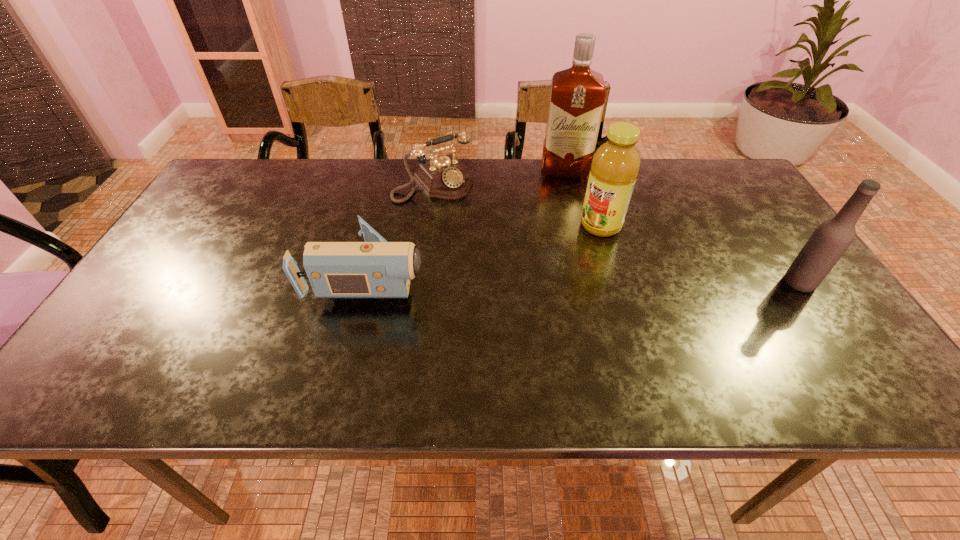
Where is `camcorder`? camcorder is located at coordinates (376, 268).

Image resolution: width=960 pixels, height=540 pixels. Identify the location of beer bottle. (830, 240).

The width and height of the screenshot is (960, 540). In order to click on the third farthest object in this screenshot , I will do `click(615, 166)`.

At what (x,y) coordinates should I click in order to perform the action: click on telephone. Please return your answer as a coordinate pair (x, y). Looking at the image, I should click on coord(446,177).

The image size is (960, 540). I want to click on liquor, so click(577, 96).

The height and width of the screenshot is (540, 960). Find the location of `vacant region located 0.400m on the side of the camcorder with the flip-out screen`. vacant region located 0.400m on the side of the camcorder with the flip-out screen is located at coordinates (593, 274).

Where is `free spot located 0.090m on the front label of the fruit juice`? free spot located 0.090m on the front label of the fruit juice is located at coordinates (568, 252).

Locate an element on the screen. vacant space situated on the front label of the fruit juice is located at coordinates (537, 279).

The image size is (960, 540). Identify the location of free space located 0.070m on the front label of the fruit juice. (573, 248).

The width and height of the screenshot is (960, 540). What are the coordinates of `free space located 0.230m on the dial of the telephone` in the screenshot? It's located at (494, 247).